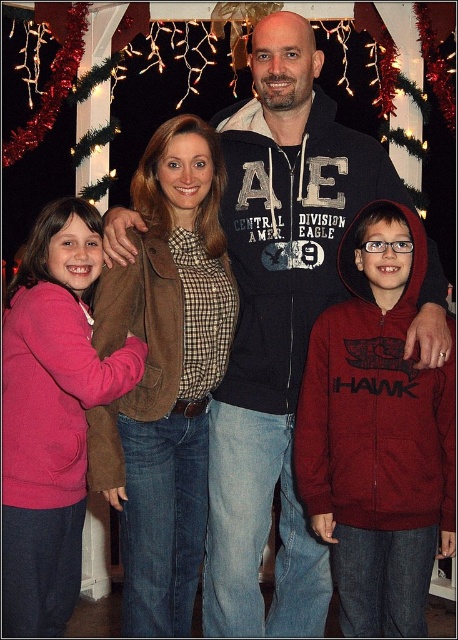
You are a photographer adjusting the camera focus. You need to focus on both the brown suede jacket at center and the burgundy fleece hoodie at center. Which one should you focus on first to ensure the closest object is sharp?

The brown suede jacket at center is closer to the viewer than the burgundy fleece hoodie at center, so you should focus on the brown suede jacket at center first to ensure it is sharp before adjusting for the other.